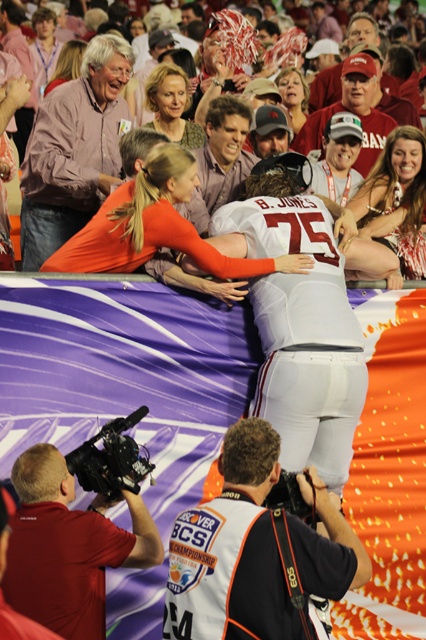
Which is below, white fabric jersey at upper center or matte orange jersey at center?

Positioned lower is white fabric jersey at upper center.

Can you confirm if white fabric jersey at upper center is bigger than matte orange jersey at center?

Actually, white fabric jersey at upper center might be smaller than matte orange jersey at center.

This screenshot has height=640, width=426. Describe the element at coordinates (253, 550) in the screenshot. I see `white fabric jersey at upper center` at that location.

Locate an element on the screen. white fabric jersey at upper center is located at coordinates (253, 550).

Which is more to the right, matte black camera at lower left or matte orange jersey at center?

matte orange jersey at center

Who is more forward, (37, 483) or (238, 291)?

Positioned in front is point (37, 483).

Who is more distant from viewer, (60, 532) or (291, 42)?

The point (291, 42) is more distant.

Where is `matte black camera at lower left`? The width and height of the screenshot is (426, 640). matte black camera at lower left is located at coordinates (68, 547).

Describe the element at coordinates (253, 550) in the screenshot. Image resolution: width=426 pixels, height=640 pixels. I see `white fabric jersey at upper center` at that location.

Who is lower down, white fabric jersey at upper center or matte black camera at lower left?

matte black camera at lower left

This screenshot has width=426, height=640. What do you see at coordinates (253, 550) in the screenshot?
I see `white fabric jersey at upper center` at bounding box center [253, 550].

The image size is (426, 640). I want to click on white fabric jersey at upper center, so click(253, 550).